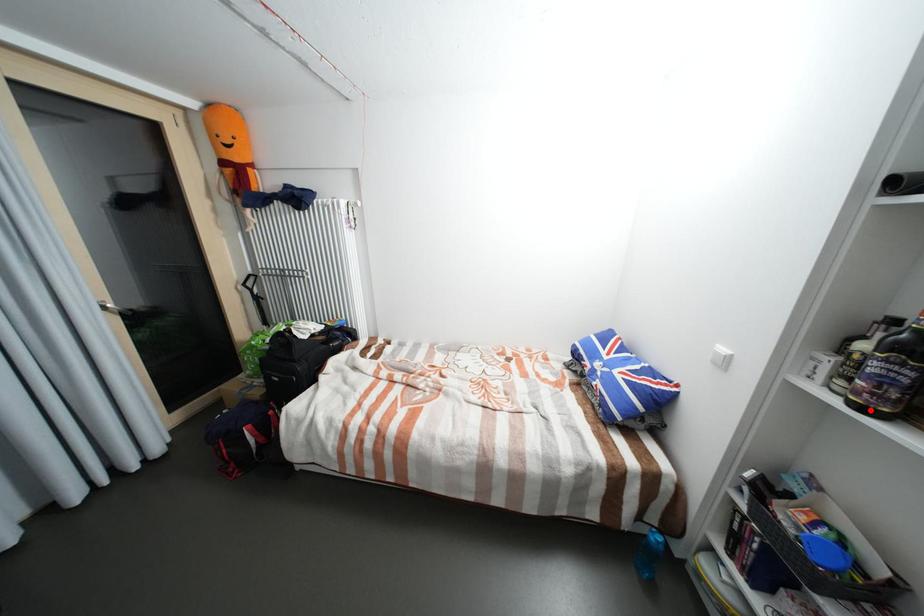
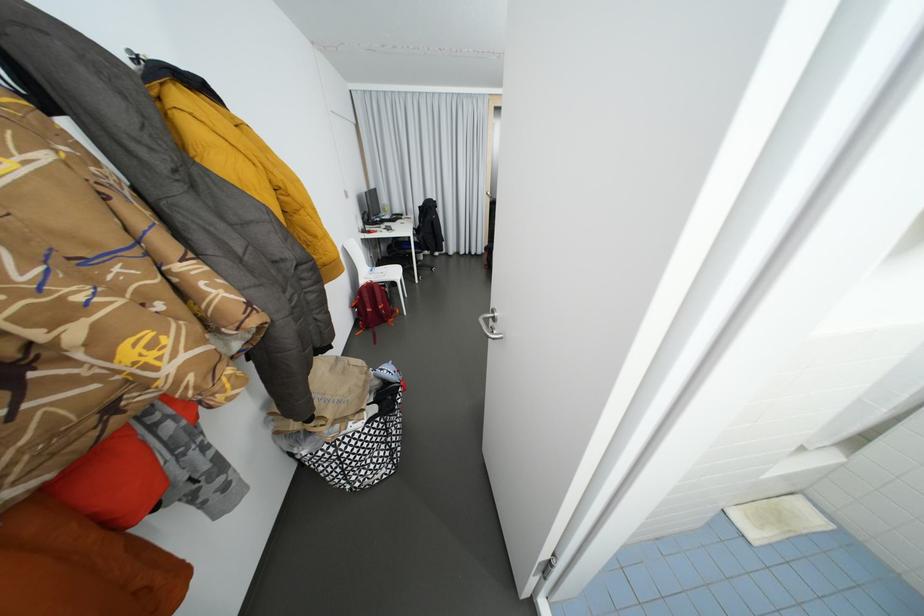
Question: I am providing you with two images of the same scene from different viewpoints. A red point is marked on the first image. Is the red point's position out of view in image 2?

Choices:
 (A) Yes
 (B) No

Answer: (A)